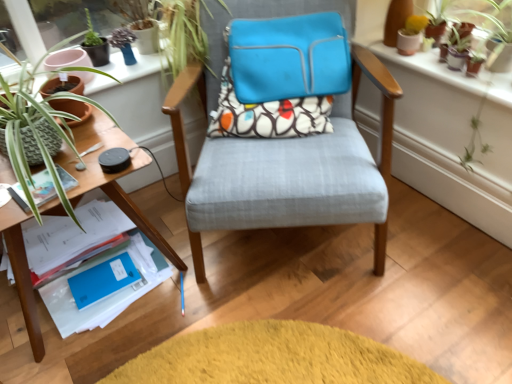
Where is `free space above patterned fabric pillow at center (from a real-world perspective)`? free space above patterned fabric pillow at center (from a real-world perspective) is located at coordinates (276, 91).